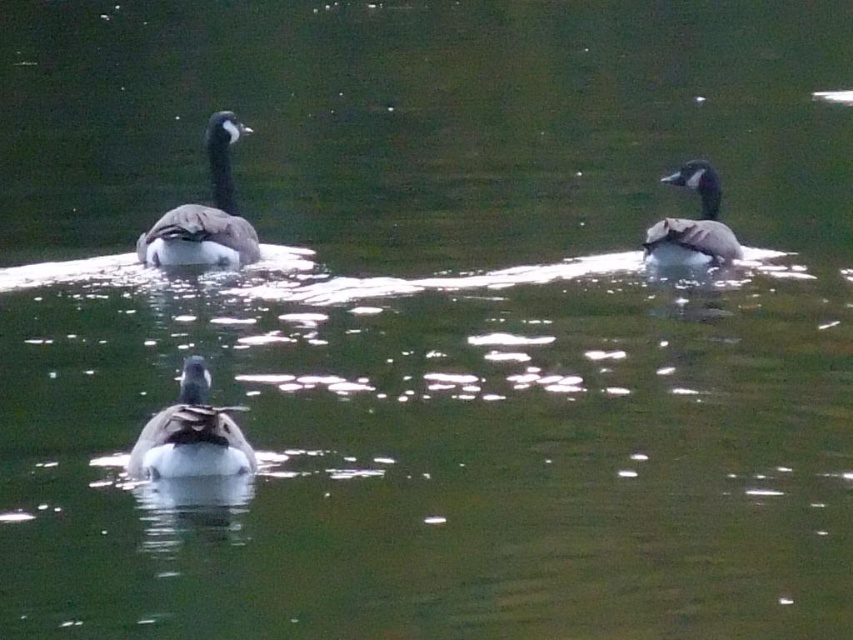
You are standing on a dock and see two Canada geese swimming in the water. The dark gray matte duck at center is one of them. How far apart are the two Canada geese?

The two Canada geese are 16.37 feet apart.

You are a photographer positioned at the origin point of the coordinate system. You want to take a photo of the Canada geese in the water. There are two points of interest marked as point (132, 465) and point (184, 256). Which point should you focus on first if you are moving forward along the positive x and y axis direction?

Point (132, 465) is in front of point (184, 256), so you should focus on point (132, 465) first since it is closer to your current position when moving forward along the positive x and y axis direction.

You are a wildlife photographer trying to capture a photo of the dark gray matte duck at upper left and the dark brown feathers at upper right. Which of the two should you focus on first if you want to ensure both are in the frame without moving the camera?

You should focus on the dark gray matte duck at upper left first because it is bigger and will be easier to locate in the frame before adjusting for the smaller dark brown feathers at upper right.